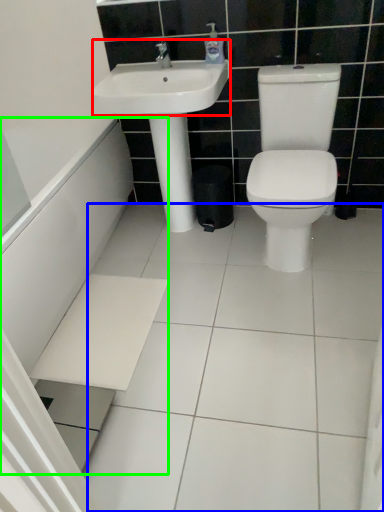
Question: Which object is positioned farthest from sink (highlighted by a red box)? Select from ceramic tile (highlighted by a blue box) and bath (highlighted by a green box).

Choices:
 (A) ceramic tile
 (B) bath

Answer: (A)